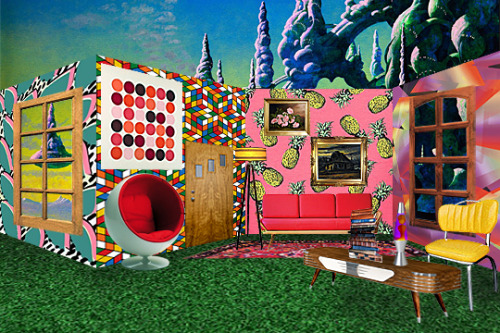
Find the location of a particular element. Image resolution: width=500 pixels, height=333 pixels. painting is located at coordinates (194, 158).